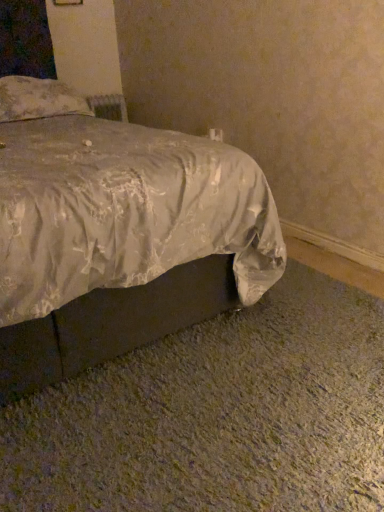
Question: Based on their sizes in the image, would you say floral fabric pillow at upper left is bigger or smaller than silvery satin bed at lower center?

Choices:
 (A) small
 (B) big

Answer: (A)

Question: From a real-world perspective, is floral fabric pillow at upper left above or below silvery satin bed at lower center?

Choices:
 (A) above
 (B) below

Answer: (A)

Question: Would you say floral fabric pillow at upper left is to the left or to the right of silvery satin bed at lower center in the picture?

Choices:
 (A) right
 (B) left

Answer: (B)

Question: Relative to floral fabric pillow at upper left, is silvery satin bed at lower center in front or behind?

Choices:
 (A) behind
 (B) front

Answer: (B)

Question: From their relative heights in the image, would you say silvery satin bed at lower center is taller or shorter than floral fabric pillow at upper left?

Choices:
 (A) short
 (B) tall

Answer: (B)

Question: Looking at the image, does silvery satin bed at lower center seem bigger or smaller compared to floral fabric pillow at upper left?

Choices:
 (A) small
 (B) big

Answer: (B)

Question: Considering the positions of silvery satin bed at lower center and floral fabric pillow at upper left in the image, is silvery satin bed at lower center wider or thinner than floral fabric pillow at upper left?

Choices:
 (A) wide
 (B) thin

Answer: (A)